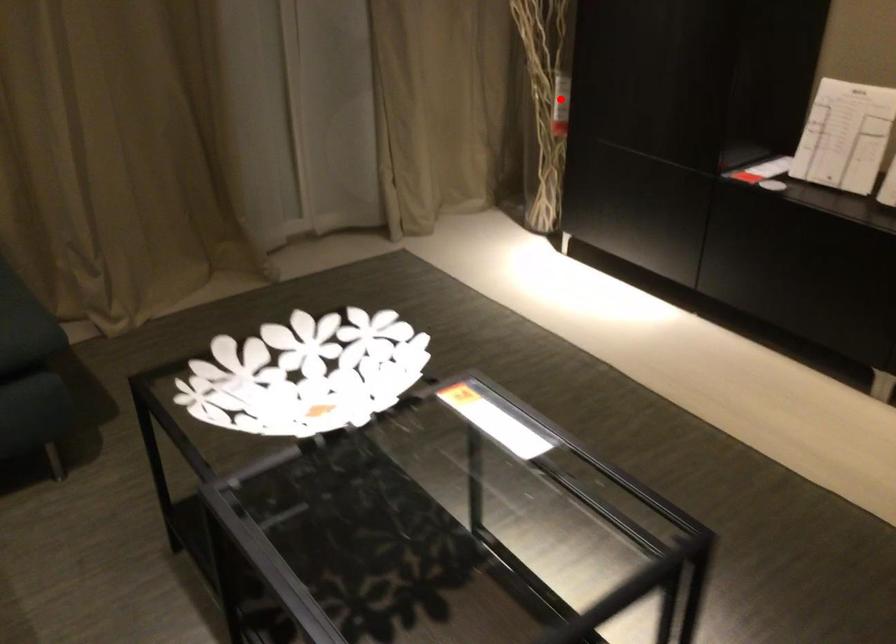
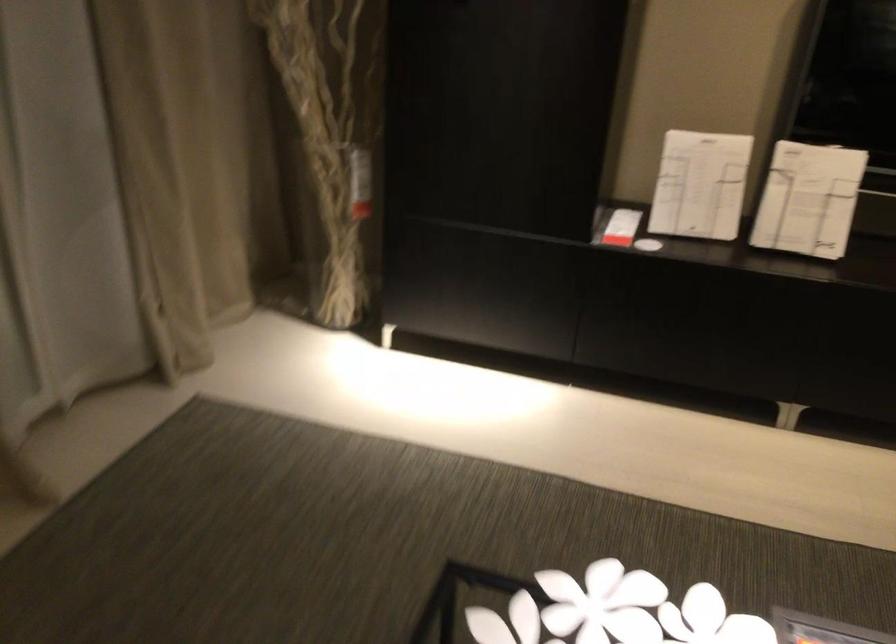
Locate, in the second image, the point that corresponds to the highlighted location in the first image.

(359, 182)